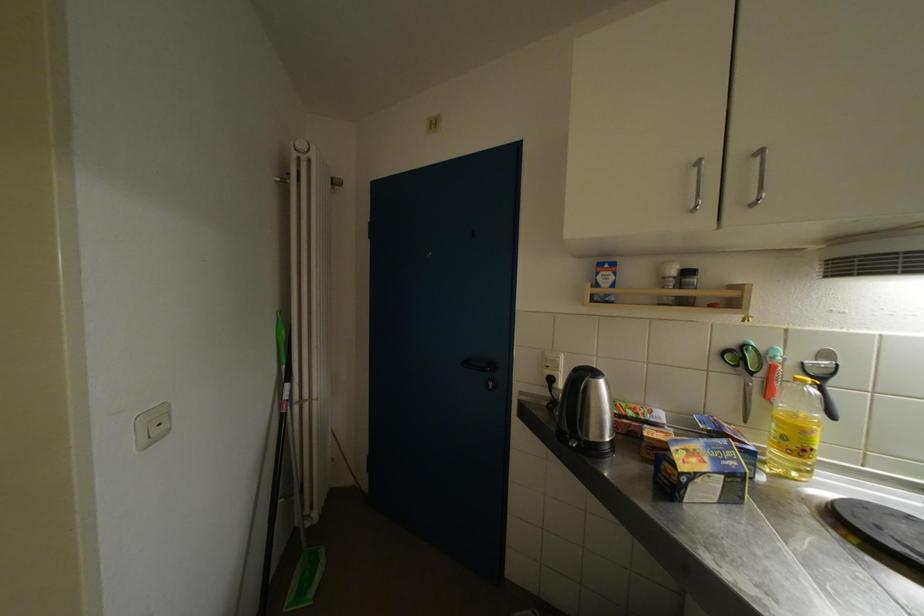
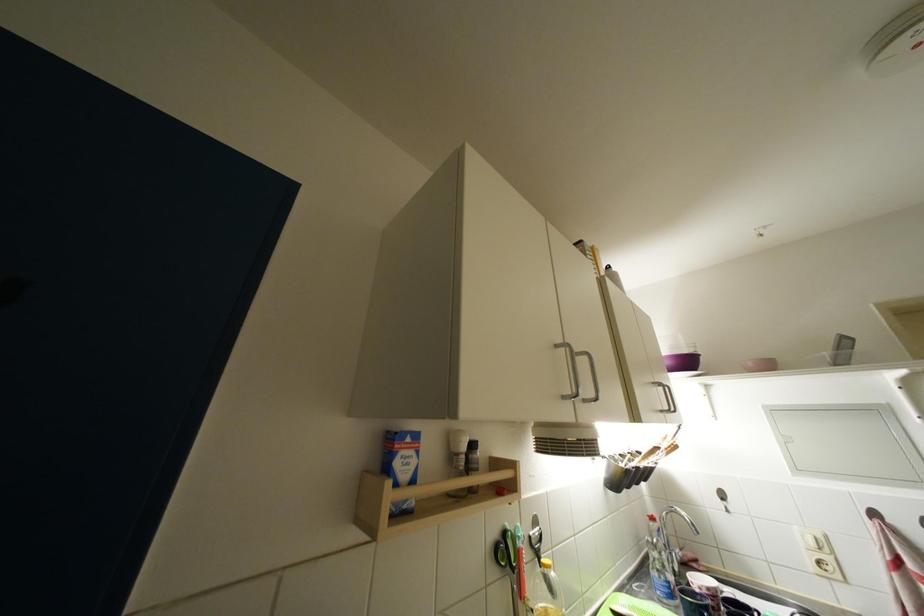
Find the pixel in the second image that matches (x=752, y=389) in the first image.

(518, 594)